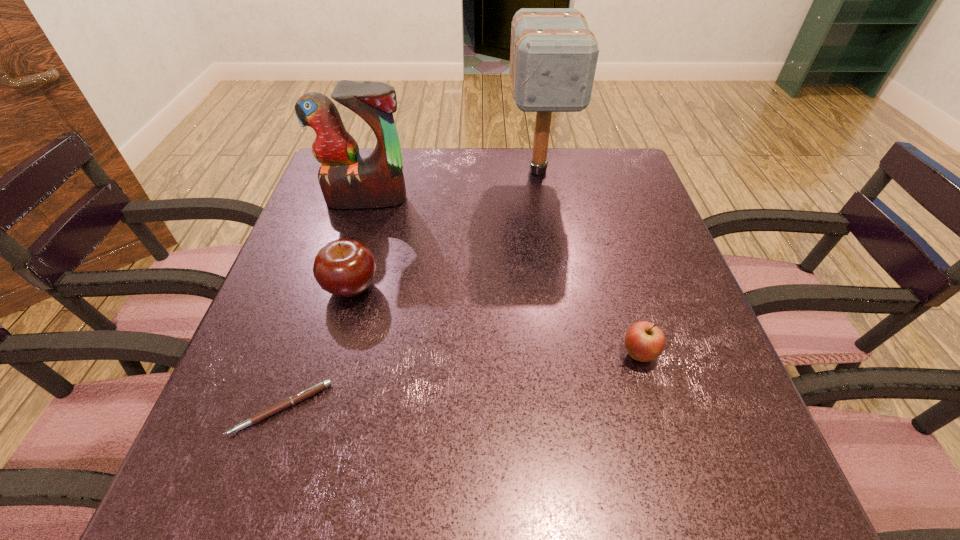
You are a GUI agent. You are given a task and a screenshot of the screen. Output one action in this format:
    pyautogui.click(x=<x>, y=<y>)
    Task: Click on the vacant area between the second shortest object and the third tallest object
    
    Given the screenshot: What is the action you would take?
    pyautogui.click(x=495, y=321)

Where is `free point between the parrot and the fourth object from left to right`? free point between the parrot and the fourth object from left to right is located at coordinates (452, 185).

The width and height of the screenshot is (960, 540). What are the coordinates of `vacant space in between the nearest object and the parrot` in the screenshot? It's located at [x=324, y=303].

Where is `empty space between the pen and the mallet`? empty space between the pen and the mallet is located at coordinates (410, 289).

Where is `object that can be found as the third closest to the fourth object from left to right`? This screenshot has height=540, width=960. object that can be found as the third closest to the fourth object from left to right is located at coordinates (644, 341).

This screenshot has width=960, height=540. I want to click on the second closest object relative to the farther apple, so click(347, 181).

Locate an element on the screen. free region that satisfies the following two spatial constraints: 1. on the striking surface of the mallet; 2. on the right side of the second nearest object is located at coordinates (568, 354).

Where is `vacant region that satisfies the following two spatial constraints: 1. at the face of the right apple; 2. on the left side of the parrot`? The width and height of the screenshot is (960, 540). vacant region that satisfies the following two spatial constraints: 1. at the face of the right apple; 2. on the left side of the parrot is located at coordinates (320, 354).

This screenshot has height=540, width=960. I want to click on vacant area in the image that satisfies the following two spatial constraints: 1. at the face of the second tallest object; 2. on the left side of the farther apple, so click(x=340, y=288).

Find the location of `blank area in the image that satisfies the following two spatial constraints: 1. at the face of the parrot; 2. on the right side of the third farthest object`. blank area in the image that satisfies the following two spatial constraints: 1. at the face of the parrot; 2. on the right side of the third farthest object is located at coordinates (340, 288).